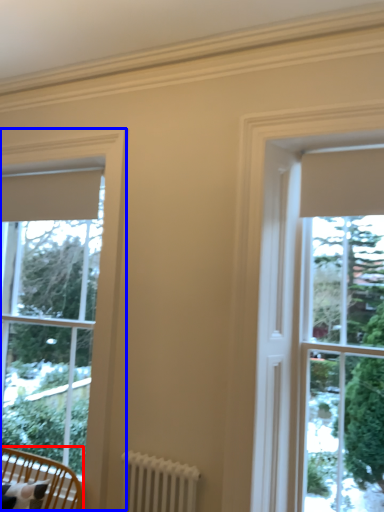
Question: Among these objects, which one is farthest to the camera, furniture (highlighted by a red box) or window (highlighted by a blue box)?

Choices:
 (A) furniture
 (B) window

Answer: (B)